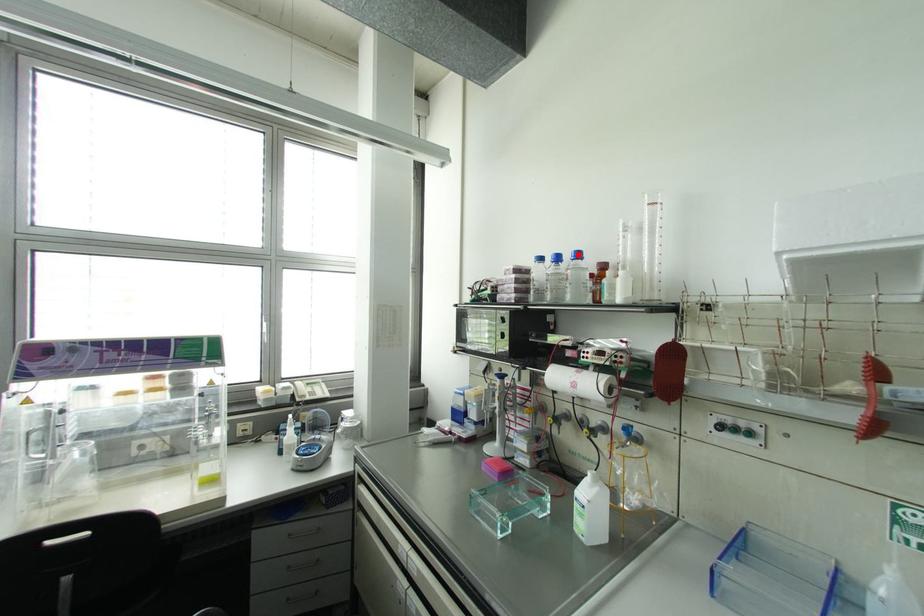
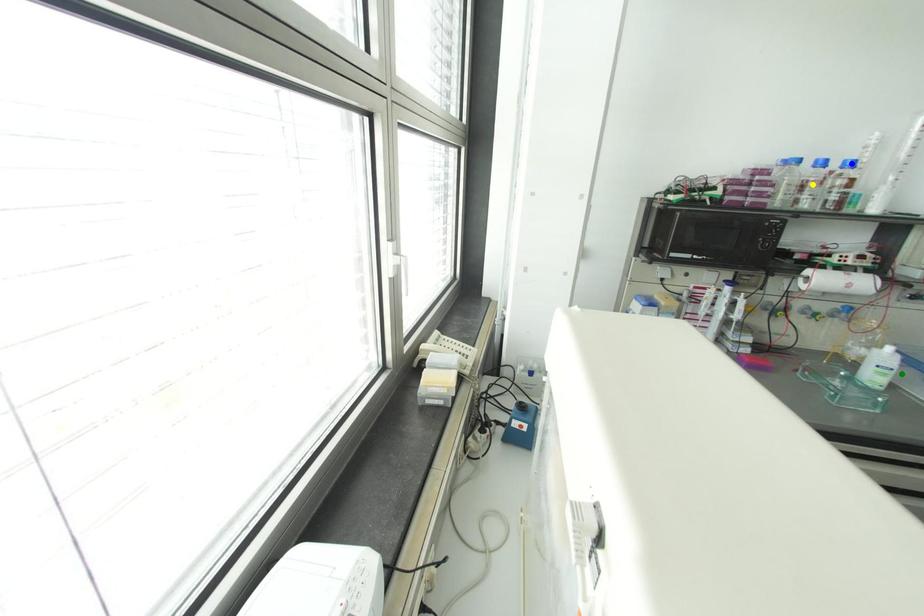
Question: I am providing you with two images of the same scene from different viewpoints. A red point is marked on the first image. You are given multiple points on the second image. Which point in image 2 is actually the same real-world point as the red point in image 1?

Choices:
 (A) green point
 (B) blue point
 (C) yellow point

Answer: (B)